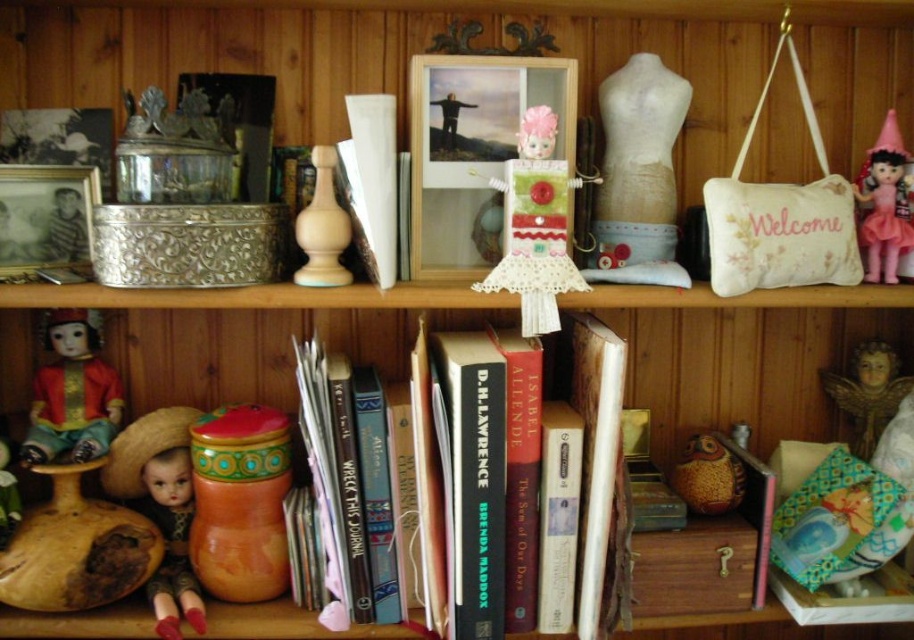
Describe the element at coordinates (885, 204) in the screenshot. I see `pink fabric doll at upper right` at that location.

Which of these two, pink fabric doll at upper right or matte brown owl at lower right, stands shorter?

matte brown owl at lower right

At what (x,y) coordinates should I click in order to perform the action: click on pink fabric doll at upper right. Please return your answer as a coordinate pair (x, y). Looking at the image, I should click on (885, 204).

The width and height of the screenshot is (914, 640). Identify the location of matte green fabric doll at center. (535, 227).

Where is `matte green fabric doll at center`? The width and height of the screenshot is (914, 640). matte green fabric doll at center is located at coordinates (535, 227).

Is white paper book at center smaller than pink fabric doll at upper right?

Incorrect, white paper book at center is not smaller in size than pink fabric doll at upper right.

Find the location of a particular element. white paper book at center is located at coordinates (373, 179).